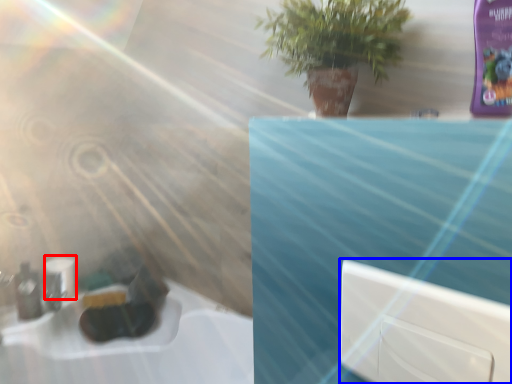
Question: Among these objects, which one is nearest to the camera, toilet paper (highlighted by a red box) or window (highlighted by a blue box)?

Choices:
 (A) toilet paper
 (B) window

Answer: (B)